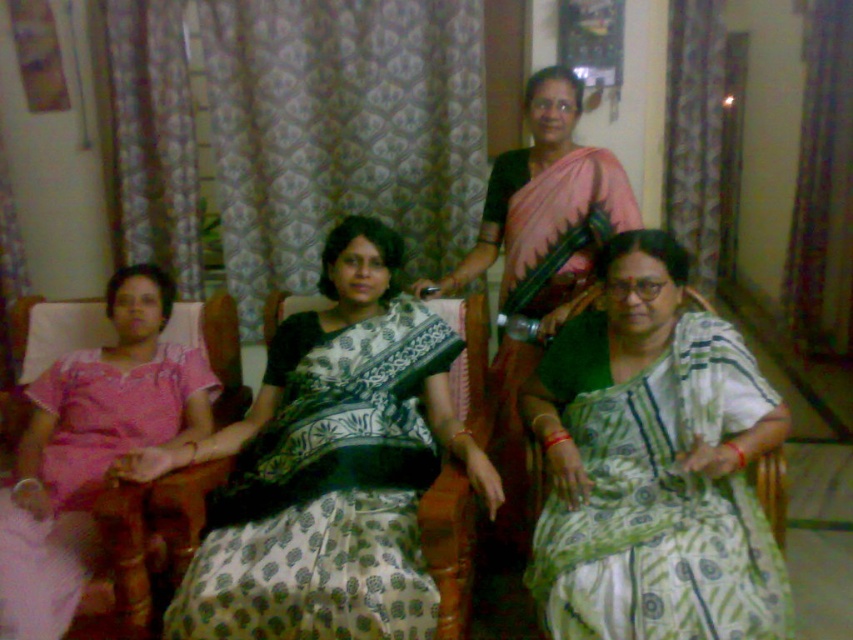
Question: Among these points, which one is farthest from the camera?

Choices:
 (A) (386, 342)
 (B) (503, 508)
 (C) (674, 493)
 (D) (173, 349)

Answer: (B)

Question: Is green printed sari at lower right above pink silk saree at center?

Choices:
 (A) yes
 (B) no

Answer: (B)

Question: In this image, where is white printed fabric dress at center located relative to green printed sari at lower right?

Choices:
 (A) right
 (B) left

Answer: (B)

Question: Which point is farther to the camera?

Choices:
 (A) pink silk saree at center
 (B) green printed sari at lower right

Answer: (A)

Question: Which of the following is the farthest from the observer?

Choices:
 (A) (339, 568)
 (B) (558, 374)
 (C) (192, 435)

Answer: (C)

Question: Is pink cotton dress at left to the left of pink silk saree at center from the viewer's perspective?

Choices:
 (A) yes
 (B) no

Answer: (A)